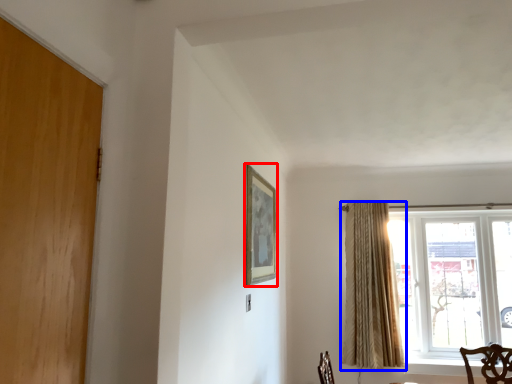
Question: Which of the following is the farthest to the observer, picture frame (highlighted by a red box) or curtain (highlighted by a blue box)?

Choices:
 (A) picture frame
 (B) curtain

Answer: (B)